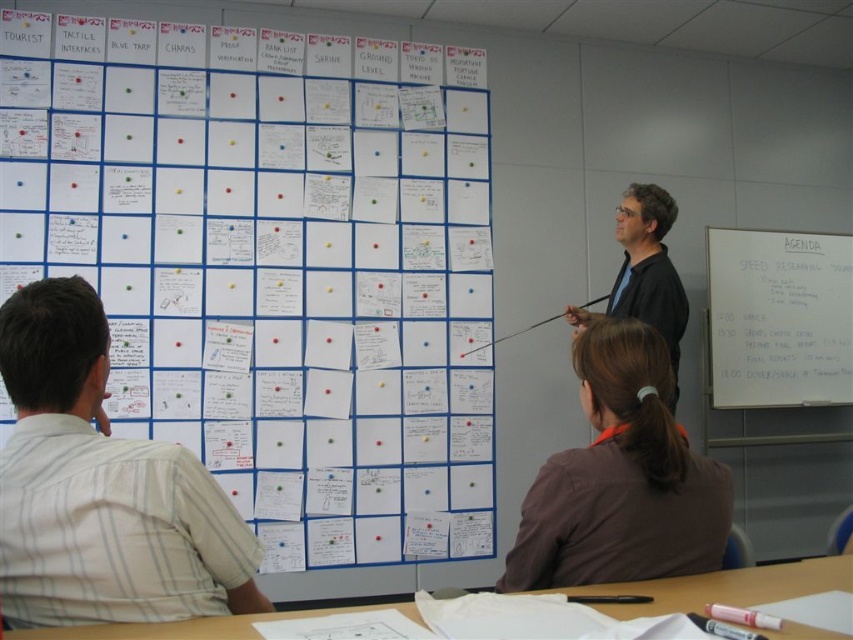
Is white paper at upper left thinner than brown fabric shirt at center?

No.

Is point (444, 355) closer to viewer compared to point (618, 406)?

That is False.

Does point (311, 33) lie behind point (669, 451)?

That is True.

Locate an element on the screen. white paper at upper left is located at coordinates (271, 260).

Does whiteboard at right appear on the right side of black matte shirt at center?

Correct, you'll find whiteboard at right to the right of black matte shirt at center.

Can you confirm if whiteboard at right is positioned to the left of black matte shirt at center?

In fact, whiteboard at right is to the right of black matte shirt at center.

The height and width of the screenshot is (640, 853). Identify the location of whiteboard at right. (776, 317).

Is white paper at upper left above whiteboard at right?

Yes.

Is point (126, 332) in front of point (787, 388)?

That is True.

Is point (143, 328) closer to viewer compared to point (717, 362)?

That is True.

Locate an element on the screen. The height and width of the screenshot is (640, 853). white paper at upper left is located at coordinates (271, 260).